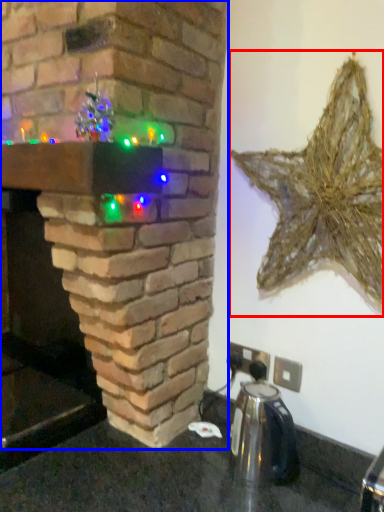
Question: Which point is further to the camera, star (highlighted by a red box) or fireplace (highlighted by a blue box)?

Choices:
 (A) star
 (B) fireplace

Answer: (A)